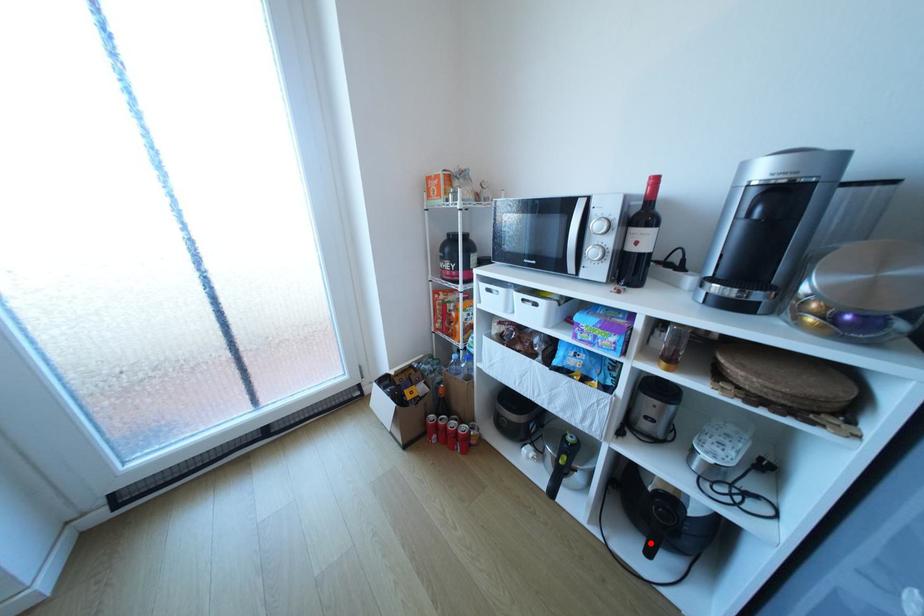
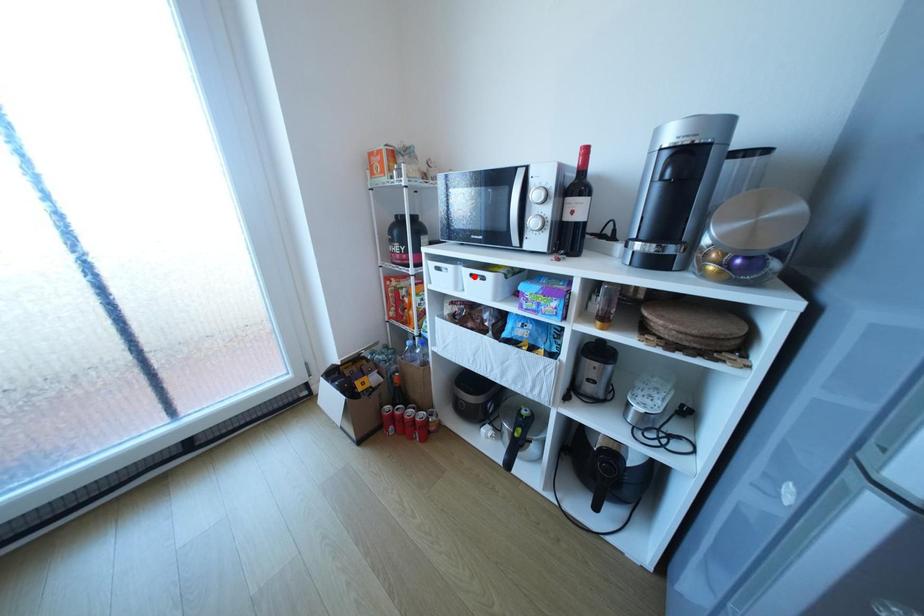
Consider the image. I am providing you with two images of the same scene from different viewpoints. A red point is marked on the first image and another point is marked on the second image. Is the marked point in image1 the same physical position as the marked point in image2?

No